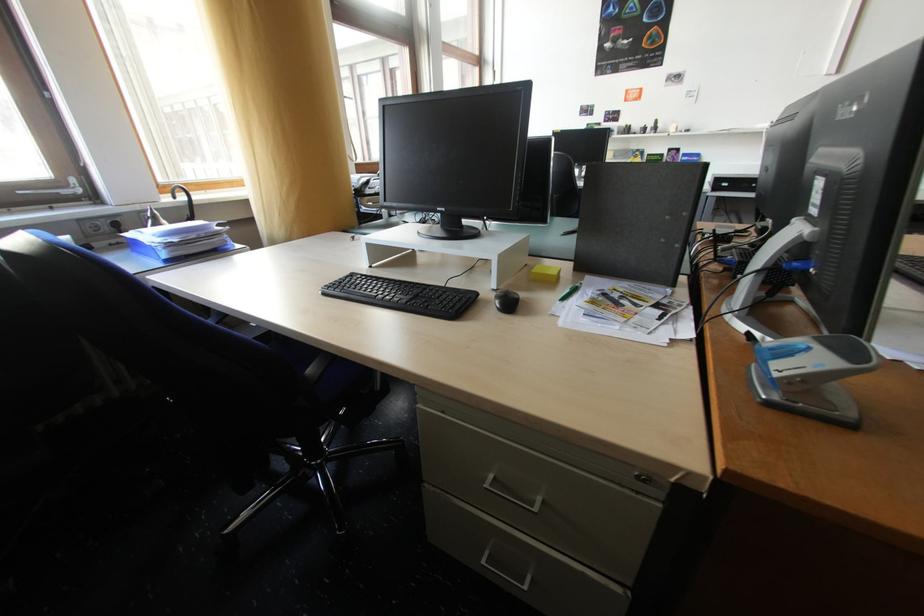
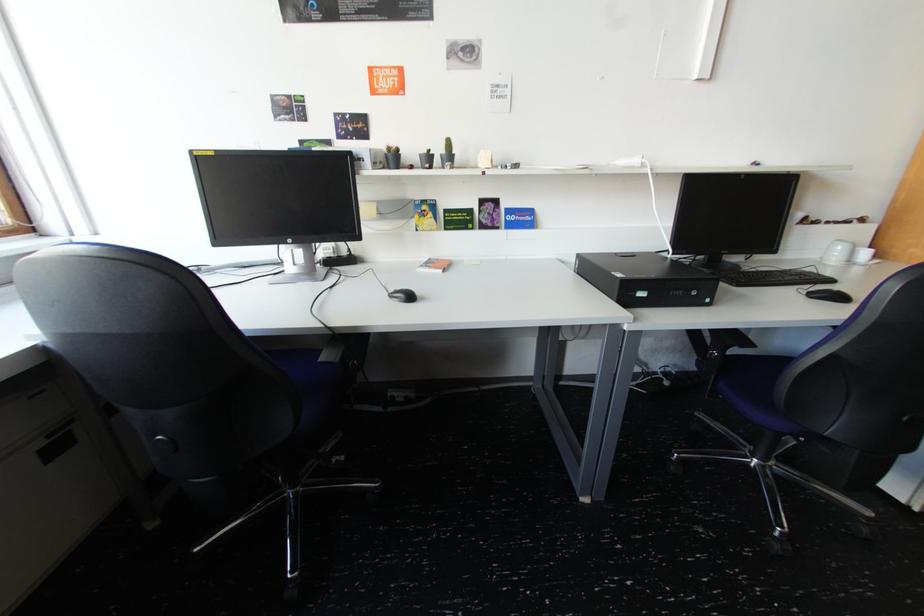
In the second image, find the point that corresponds to point (636, 127) in the first image.

(397, 150)